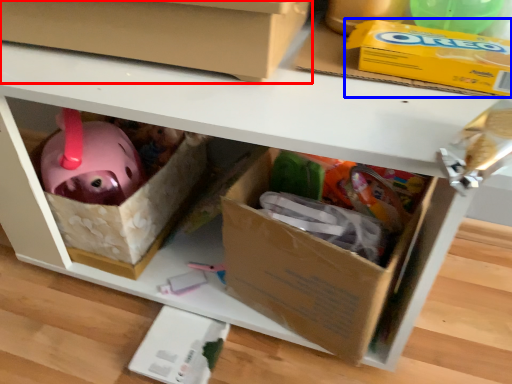
Question: Among these objects, which one is nearest to the camera, box (highlighted by a red box) or storage box (highlighted by a blue box)?

Choices:
 (A) box
 (B) storage box

Answer: (A)